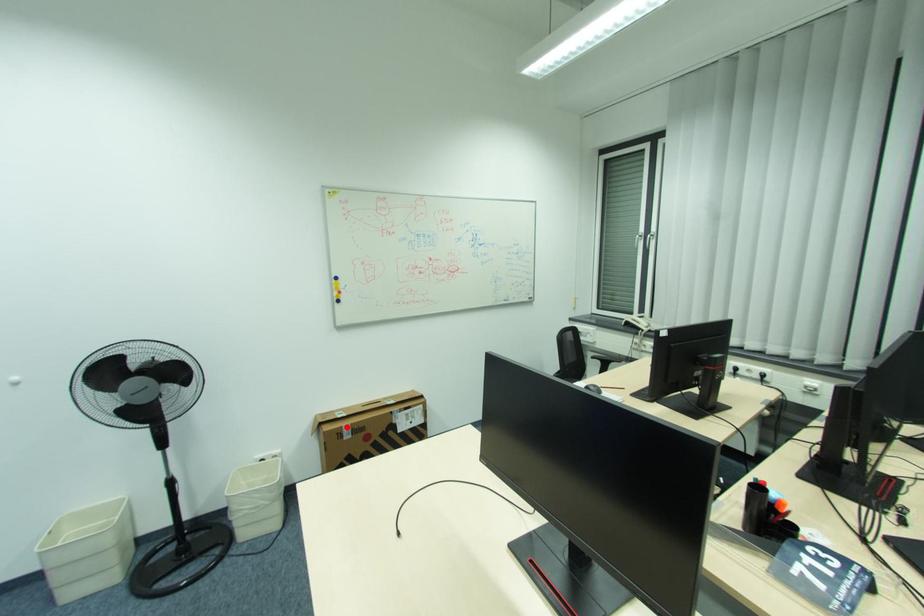
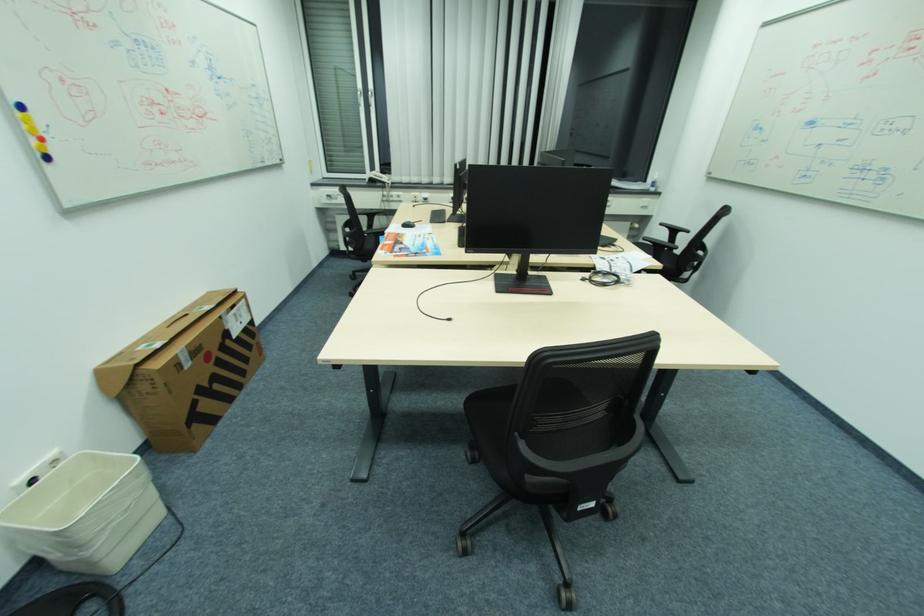
Question: I am providing you with two images of the same scene from different viewpoints. A red point is shown in image1. For the corresponding object point in image2, is it positioned nearer or farther from the camera?

Choices:
 (A) Nearer
 (B) Farther

Answer: (A)